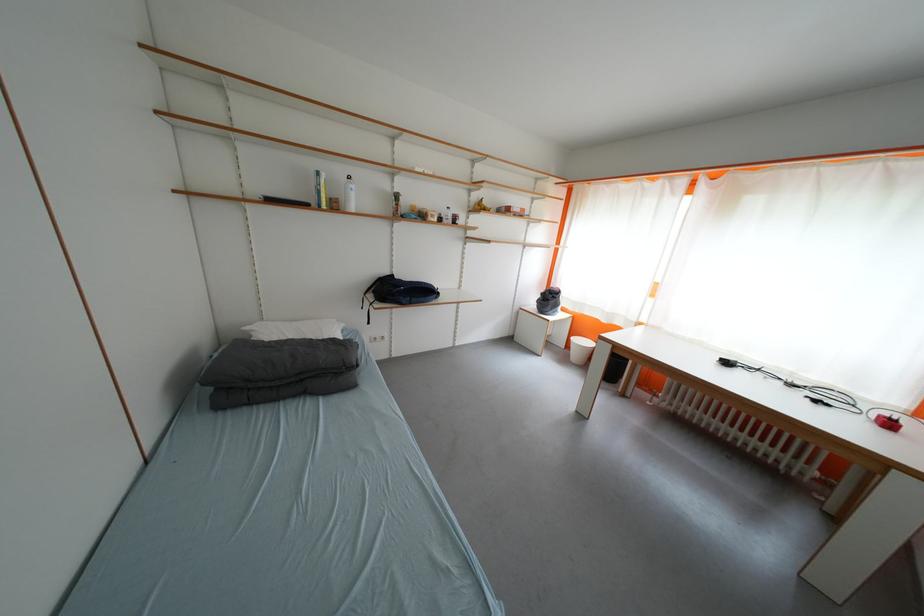
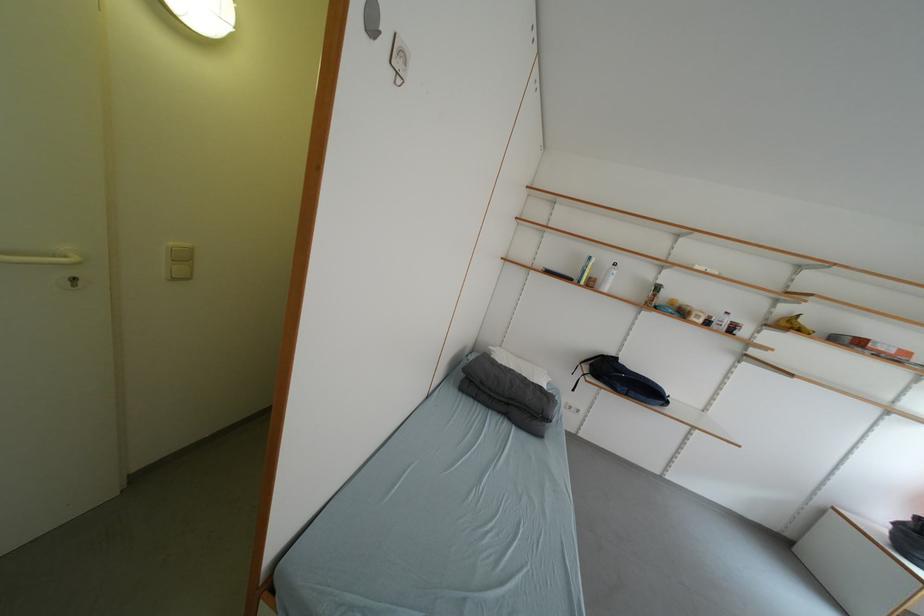
Find the pixel in the second image that matches (x=422, y=302) in the first image.

(640, 395)